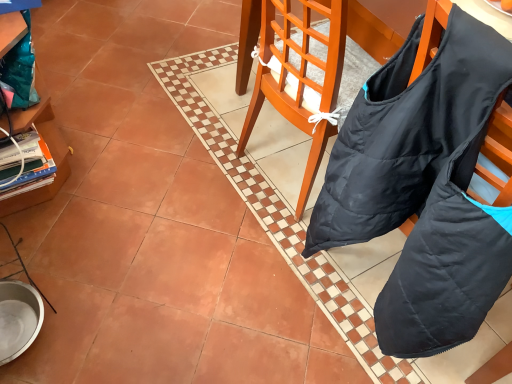
Question: Considering the relative sizes of black fabric bag at center and wooden cabinet at left in the image provided, is black fabric bag at center smaller than wooden cabinet at left?

Choices:
 (A) no
 (B) yes

Answer: (B)

Question: Can we say black fabric bag at center lies outside wooden cabinet at left?

Choices:
 (A) no
 (B) yes

Answer: (B)

Question: Is wooden cabinet at left at the back of black fabric bag at center?

Choices:
 (A) no
 (B) yes

Answer: (A)

Question: Can wooden cabinet at left be found inside black fabric bag at center?

Choices:
 (A) yes
 (B) no

Answer: (B)

Question: Considering the relative sizes of black fabric bag at center and wooden cabinet at left in the image provided, is black fabric bag at center wider than wooden cabinet at left?

Choices:
 (A) yes
 (B) no

Answer: (A)

Question: Is black fabric bag at center next to wooden cabinet at left and touching it?

Choices:
 (A) no
 (B) yes

Answer: (A)

Question: Is wooden cabinet at left facing away from black fabric bag at center?

Choices:
 (A) no
 (B) yes

Answer: (A)

Question: Considering the relative sizes of wooden cabinet at left and black fabric bag at center in the image provided, is wooden cabinet at left smaller than black fabric bag at center?

Choices:
 (A) no
 (B) yes

Answer: (A)

Question: From the image's perspective, is wooden cabinet at left located beneath black fabric bag at center?

Choices:
 (A) no
 (B) yes

Answer: (A)

Question: Does wooden cabinet at left have a lesser width compared to black fabric bag at center?

Choices:
 (A) no
 (B) yes

Answer: (B)

Question: Is wooden cabinet at left not near black fabric bag at center?

Choices:
 (A) yes
 (B) no

Answer: (B)

Question: Is wooden cabinet at left next to black fabric bag at center and touching it?

Choices:
 (A) no
 (B) yes

Answer: (A)

Question: Is wooden cabinet at left taller or shorter than black fabric bag at center?

Choices:
 (A) short
 (B) tall

Answer: (A)